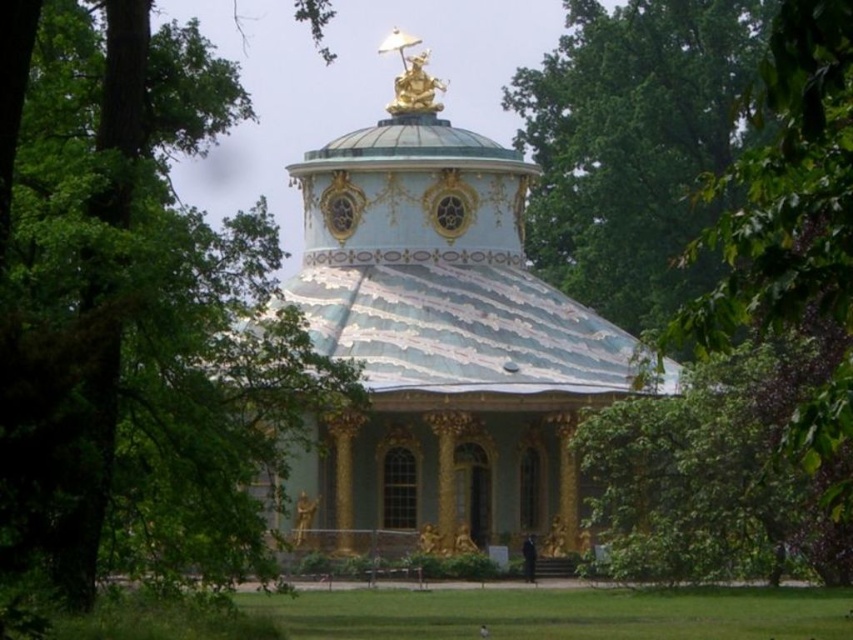
Between green leafy tree at upper left and porcelain dome at center, which one has less height?

With less height is porcelain dome at center.

Is point (132, 244) farther from viewer compared to point (389, 428)?

No, (132, 244) is in front of (389, 428).

Where is `green leafy tree at upper left`? The image size is (853, 640). green leafy tree at upper left is located at coordinates (132, 317).

Is green leafy tree at upper left wider than green leafy tree at upper center?

No, green leafy tree at upper left is not wider than green leafy tree at upper center.

Is point (210, 227) positioned after point (596, 99)?

Yes, it is behind point (596, 99).

At what (x,y) coordinates should I click in order to perform the action: click on green leafy tree at upper left. Please return your answer as a coordinate pair (x, y). The height and width of the screenshot is (640, 853). Looking at the image, I should click on (132, 317).

Does porcelain dome at center appear under green leafy tree at upper center?

Correct, porcelain dome at center is located below green leafy tree at upper center.

Can you confirm if porcelain dome at center is taller than green leafy tree at upper center?

Yes.

Image resolution: width=853 pixels, height=640 pixels. In order to click on porcelain dome at center in this screenshot , I will do `click(442, 340)`.